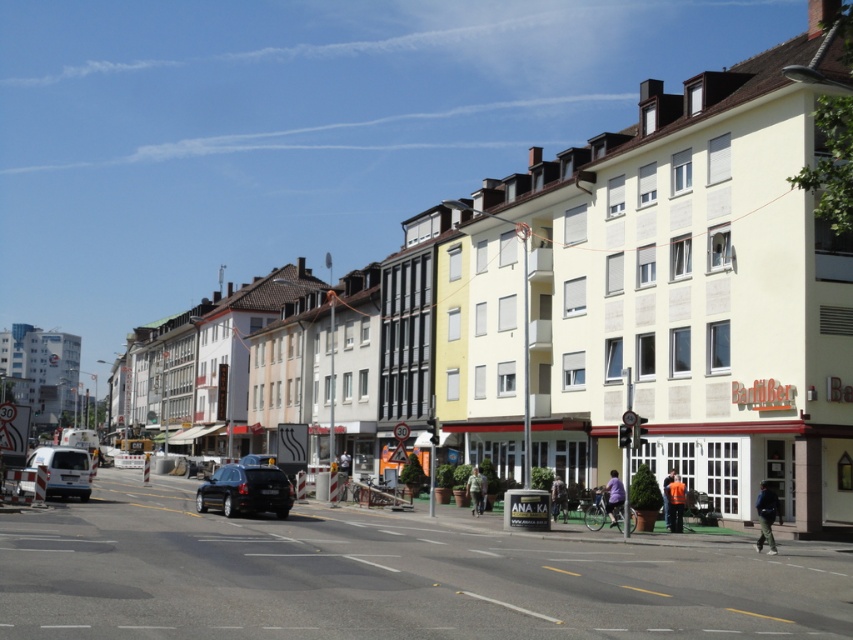
Does shiny black car at center have a smaller size compared to white matte van at lower left?

Yes.

Is shiny black car at center wider than white matte van at lower left?

In fact, shiny black car at center might be narrower than white matte van at lower left.

Who is more forward, (x=213, y=474) or (x=49, y=483)?

Positioned in front is point (x=213, y=474).

Where is `shiny black car at center`? The image size is (853, 640). shiny black car at center is located at coordinates (245, 490).